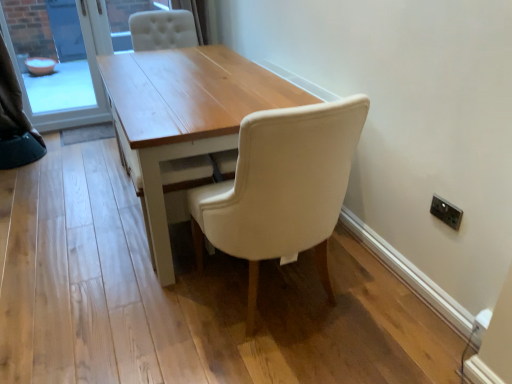
Describe the element at coordinates (186, 114) in the screenshot. I see `light wood table at center` at that location.

This screenshot has width=512, height=384. I want to click on white fabric curtain at upper left, so click(x=15, y=120).

This screenshot has width=512, height=384. What do you see at coordinates (281, 188) in the screenshot?
I see `matte white chair at center` at bounding box center [281, 188].

Where is `light wood table at center`? The image size is (512, 384). light wood table at center is located at coordinates (186, 114).

Is matte white chair at center bigger than white fabric curtain at upper left?

Yes.

Which point is more distant from viewer, (285, 253) or (38, 133)?

The point (38, 133) is more distant.

Who is taller, matte glass bowl at left or light wood table at center?

With more height is matte glass bowl at left.

From the picture: Considering their positions, is matte glass bowl at left located in front of or behind light wood table at center?

Clearly, matte glass bowl at left is behind light wood table at center.

Can you see matte glass bowl at left touching light wood table at center?

There is a gap between matte glass bowl at left and light wood table at center.

Considering the relative sizes of matte glass bowl at left and light wood table at center in the image provided, is matte glass bowl at left thinner than light wood table at center?

Yes, matte glass bowl at left is thinner than light wood table at center.

Can you confirm if matte white chair at center is wider than matte glass bowl at left?

Yes, matte white chair at center is wider than matte glass bowl at left.

From the image's perspective, is matte white chair at center below matte glass bowl at left?

Yes.

At what (x,y) coordinates should I click in order to perform the action: click on window screen that appears on the left of matte white chair at center. Please return your answer as a coordinate pair (x, y). Image resolution: width=512 pixels, height=384 pixels. Looking at the image, I should click on (51, 53).

Who is shorter, matte white chair at center or matte glass bowl at left?

Standing shorter between the two is matte white chair at center.

Is there a large distance between light wood table at center and matte white chair at center?

light wood table at center is near matte white chair at center, not far away.

Looking at this image, is light wood table at center at the right side of matte white chair at center?

No, light wood table at center is not to the right of matte white chair at center.

Between light wood table at center and matte white chair at center, which one has more height?

Standing taller between the two is matte white chair at center.

Looking at this image, from the image's perspective, would you say light wood table at center is positioned over matte white chair at center?

Yes, from the image's perspective, light wood table at center is on top of matte white chair at center.

Does white fabric curtain at upper left have a lesser height compared to light wood table at center?

No.

Is the depth of white fabric curtain at upper left greater than that of light wood table at center?

Yes, it is behind light wood table at center.

From a real-world perspective, is white fabric curtain at upper left above or below light wood table at center?

Clearly, from a real-world perspective, white fabric curtain at upper left is above light wood table at center.

Choose the correct answer: Is white fabric curtain at upper left inside light wood table at center or outside it?

white fabric curtain at upper left is not inside light wood table at center, it's outside.

Which is more to the right, white fabric curtain at upper left or matte glass bowl at left?

matte glass bowl at left.

Is white fabric curtain at upper left smaller than matte glass bowl at left?

Correct, white fabric curtain at upper left occupies less space than matte glass bowl at left.

Is white fabric curtain at upper left facing towards matte glass bowl at left?

No.

Considering the positions of point (0, 167) and point (26, 44), is point (0, 167) closer or farther from the camera than point (26, 44)?

Clearly, point (0, 167) is closer to the camera than point (26, 44).

Between point (35, 23) and point (39, 157), which one is positioned in front?

The point (39, 157) is in front.

Which is correct: matte glass bowl at left is inside white fabric curtain at upper left, or outside of it?

matte glass bowl at left lies outside white fabric curtain at upper left.

From the image's perspective, who appears lower, matte glass bowl at left or white fabric curtain at upper left?

white fabric curtain at upper left appears lower in the image.

You are a GUI agent. You are given a task and a screenshot of the screen. Output one action in this format:
    pyautogui.click(x=<x>, y=<y>)
    Task: Click on the curtain on the left of the matte glass bowl at left
    The image size is (512, 384).
    Given the screenshot: What is the action you would take?
    pyautogui.click(x=15, y=120)

Find the location of a particular element. The height and width of the screenshot is (384, 512). chair beneath the white fabric curtain at upper left (from a real-world perspective) is located at coordinates (281, 188).

Find the location of a particular element. window screen lying on the left of light wood table at center is located at coordinates (51, 53).

Estimate the real-world distances between objects in this image. Which object is closer to matte white chair at center, white fabric curtain at upper left or light wood table at center?

The object closer to matte white chair at center is light wood table at center.

From the picture: Considering their positions, is light wood table at center positioned closer to matte glass bowl at left than matte white chair at center?

light wood table at center is positioned closer to the anchor matte glass bowl at left.

Considering their positions, is matte white chair at center positioned further to white fabric curtain at upper left than light wood table at center?

The object further to white fabric curtain at upper left is matte white chair at center.

Based on their spatial positions, is light wood table at center or matte glass bowl at left further from white fabric curtain at upper left?

light wood table at center.

Based on their spatial positions, is light wood table at center or white fabric curtain at upper left further from matte white chair at center?

The object further to matte white chair at center is white fabric curtain at upper left.

Looking at the image, which one is located further to matte glass bowl at left, matte white chair at center or light wood table at center?

Based on the image, matte white chair at center appears to be further to matte glass bowl at left.

Which object lies nearer to the anchor point white fabric curtain at upper left, matte glass bowl at left or light wood table at center?

The object closer to white fabric curtain at upper left is matte glass bowl at left.

Which object lies further to the anchor point matte glass bowl at left, white fabric curtain at upper left or matte white chair at center?

Among the two, matte white chair at center is located further to matte glass bowl at left.

I want to click on table located between matte white chair at center and matte glass bowl at left in the depth direction, so click(x=186, y=114).

Identify the location of window screen between white fabric curtain at upper left and light wood table at center. 51,53.

I want to click on table between white fabric curtain at upper left and matte white chair at center, so click(186, 114).

Where is `window screen situated between white fabric curtain at upper left and matte white chair at center from left to right`? The height and width of the screenshot is (384, 512). window screen situated between white fabric curtain at upper left and matte white chair at center from left to right is located at coordinates (51, 53).